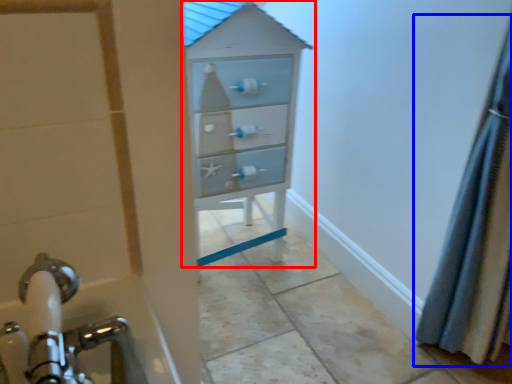
Question: Which point is closer to the camera, chest of drawers (highlighted by a red box) or shower curtain (highlighted by a blue box)?

Choices:
 (A) chest of drawers
 (B) shower curtain

Answer: (B)